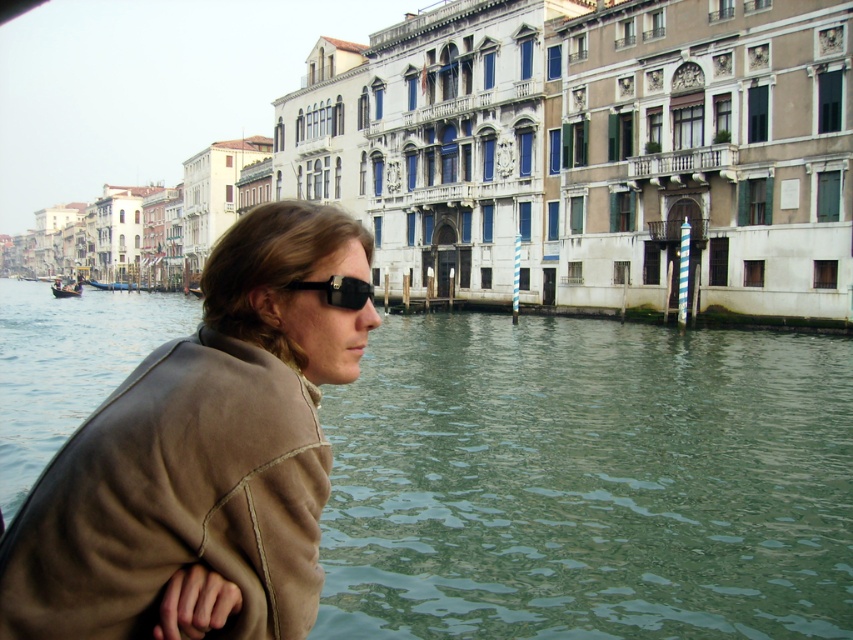
Question: Is green water at lower left thinner than black matte sunglasses at upper left?

Choices:
 (A) yes
 (B) no

Answer: (B)

Question: Does brown leather jacket at left appear under black matte sunglasses at upper left?

Choices:
 (A) yes
 (B) no

Answer: (A)

Question: Which of the following is the farthest from the observer?

Choices:
 (A) (523, 484)
 (B) (61, 296)
 (C) (335, 288)
 (D) (218, 509)

Answer: (B)

Question: Considering the real-world distances, which object is farthest from the green water at lower left?

Choices:
 (A) wooden gondola at left
 (B) black matte sunglasses at upper left

Answer: (A)

Question: Among these points, which one is farthest from the camera?

Choices:
 (A) (368, 349)
 (B) (155, 422)

Answer: (A)

Question: Does black matte sunglasses at upper left appear on the right side of wooden gondola at left?

Choices:
 (A) no
 (B) yes

Answer: (B)